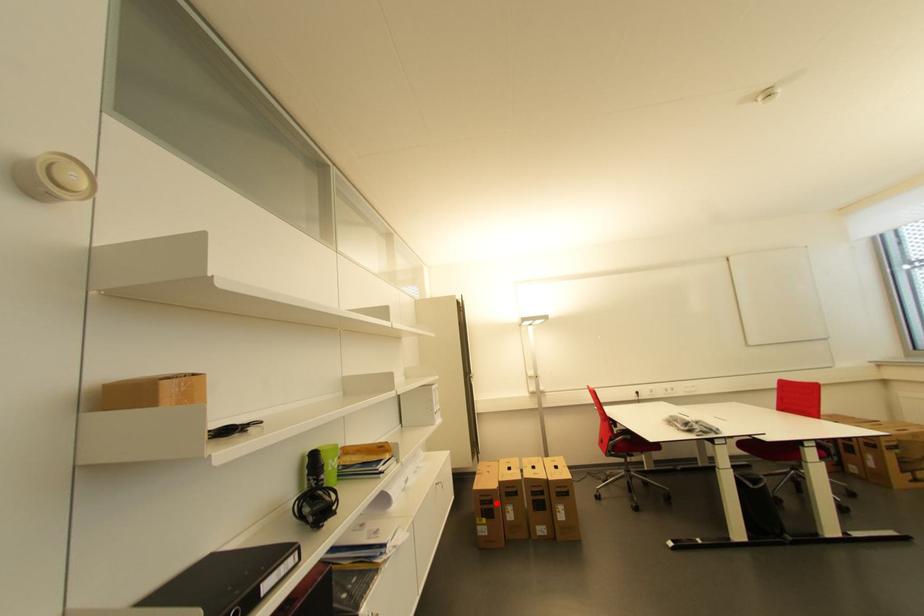
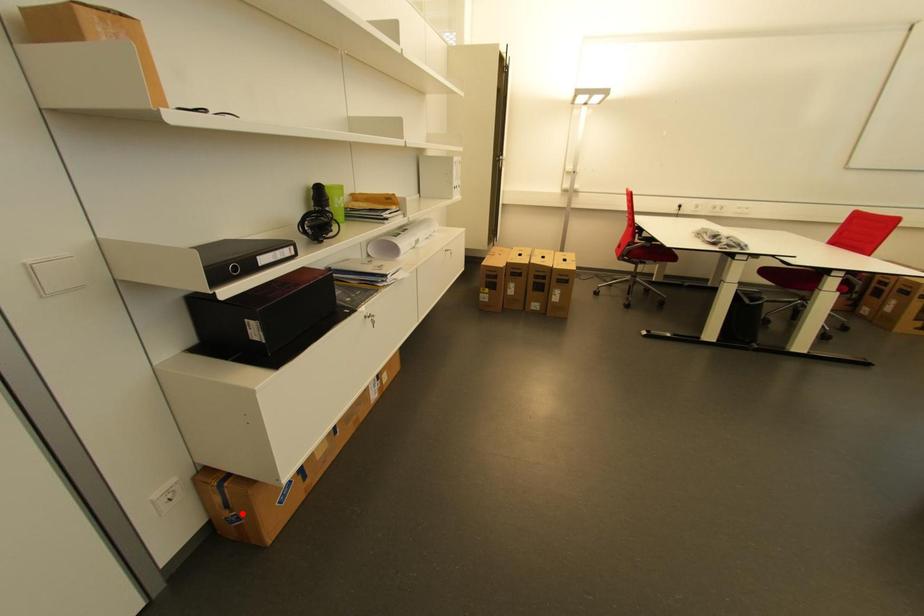
I am providing you with two images of the same scene from different viewpoints. A red point is marked on the first image and another point is marked on the second image. Is the marked point in image1 the same physical position as the marked point in image2?

No